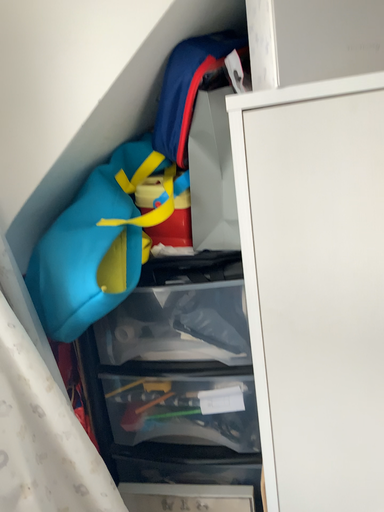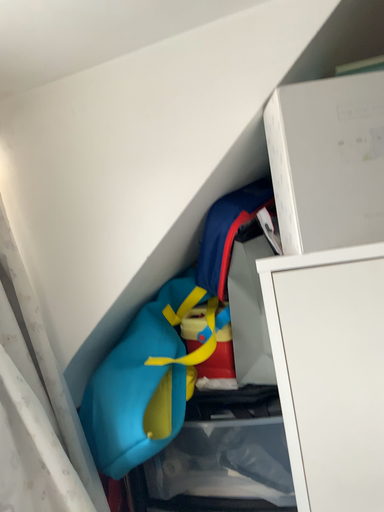
Question: Which way did the camera rotate in the video?

Choices:
 (A) rotated right
 (B) rotated left

Answer: (B)